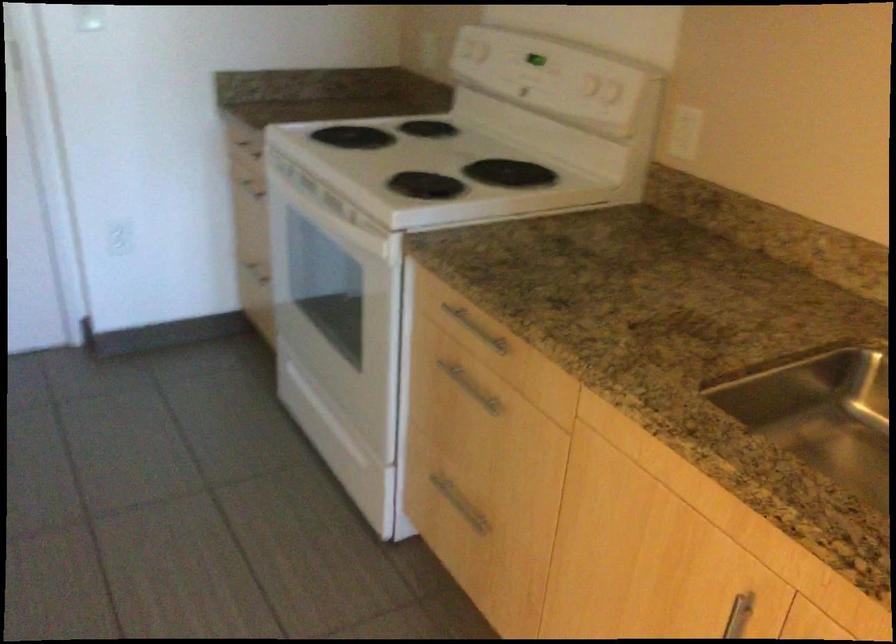
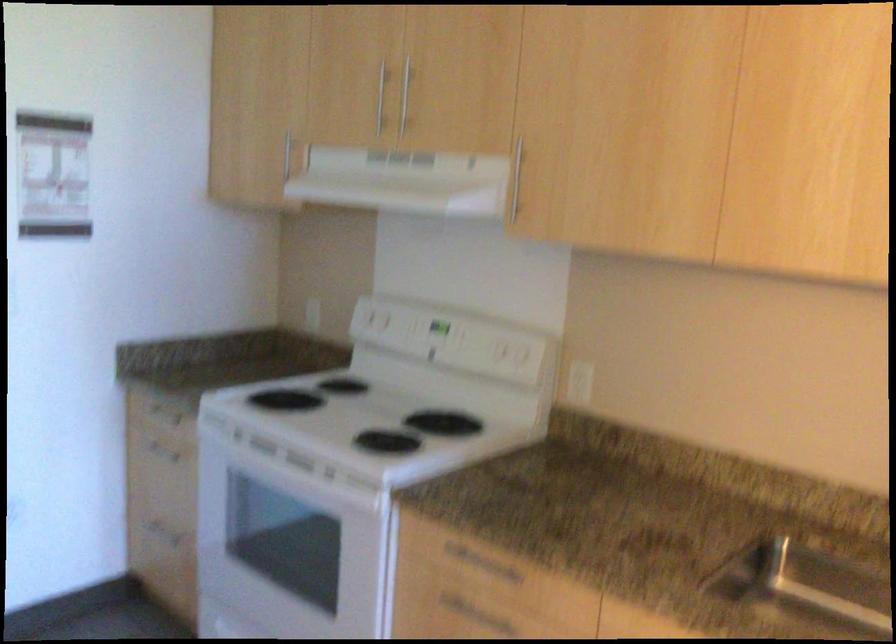
In the second image, find the point that corresponds to pixel 461 374 in the first image.

(466, 609)